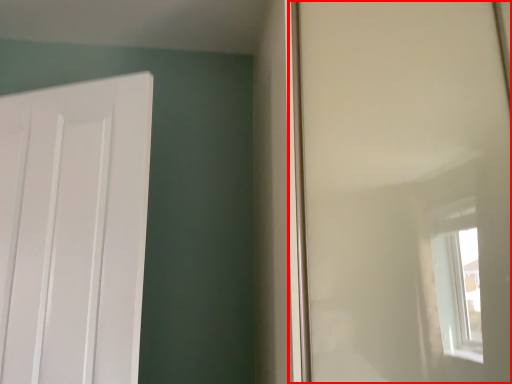
Question: In this image, where is window screen (annotated by the red box) located relative to door?

Choices:
 (A) left
 (B) right

Answer: (B)